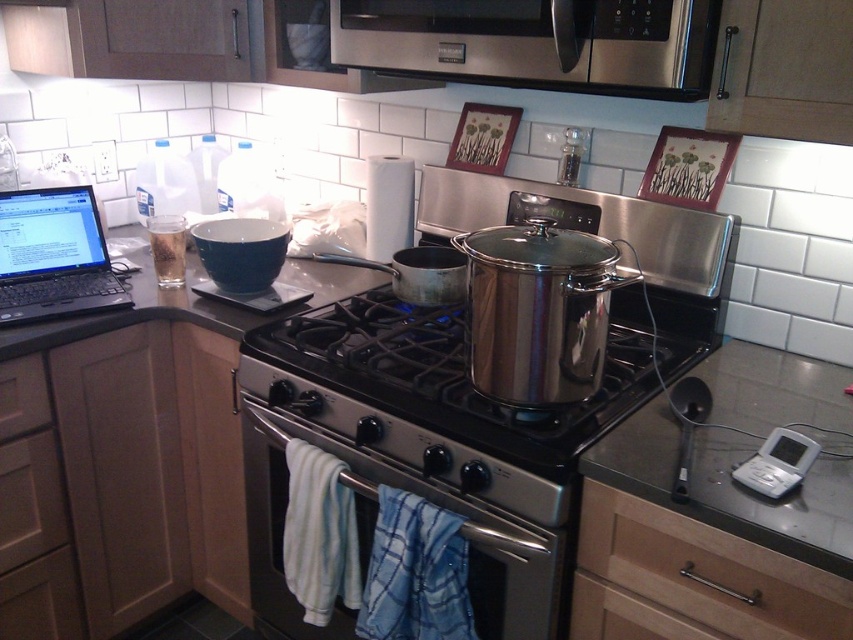
Can you confirm if stainless steel gas stove at center is shorter than black matte laptop at upper left?

Correct, stainless steel gas stove at center is not as tall as black matte laptop at upper left.

Which of these two, stainless steel gas stove at center or black matte laptop at upper left, stands taller?

black matte laptop at upper left

I want to click on stainless steel gas stove at center, so click(x=456, y=372).

Is point (409, 305) in front of point (648, 605)?

No, it is behind (648, 605).

Does stainless steel gas stove at center lie in front of wooden drawer at lower right?

No.

This screenshot has height=640, width=853. What do you see at coordinates (456, 372) in the screenshot?
I see `stainless steel gas stove at center` at bounding box center [456, 372].

This screenshot has width=853, height=640. What are the coordinates of `stainless steel gas stove at center` in the screenshot? It's located at (456, 372).

Does wooden drawer at lower right appear on the right side of black matte laptop at upper left?

Yes, wooden drawer at lower right is to the right of black matte laptop at upper left.

Consider the image. Is wooden drawer at lower right bigger than black matte laptop at upper left?

No.

Is point (759, 612) less distant than point (74, 282)?

Yes, it is.

Find the location of a particular element. wooden drawer at lower right is located at coordinates (691, 579).